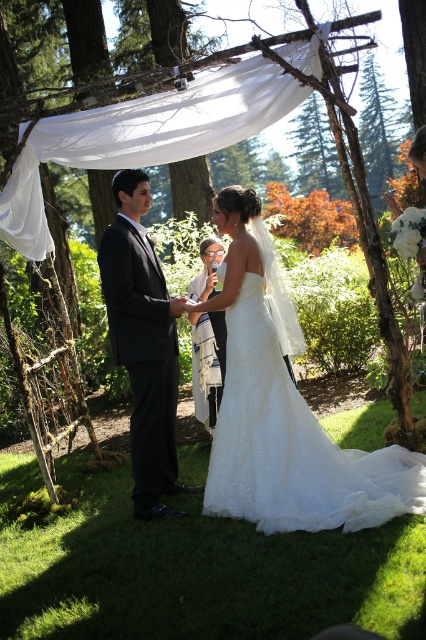
You are a photographer at the wedding and want to ensure both the white lace wedding dress at center and the black satin suit at center are fully visible in the photo. Given that the camera frame can only accommodate the width of the wider of the two, which one should you focus on to capture both properly?

The white lace wedding dress at center has a larger width than the black satin suit at center. Therefore, focusing on the white lace wedding dress at center will ensure the camera frame can accommodate both, as its width is wider.

You are a photographer at the wedding ceremony. You need to capture a photo where the white lace wedding dress at center is visible above the black satin suit at center. Based on the current arrangement, is this possible?

The white lace wedding dress at center is below the black satin suit at center, so it is not possible to capture a photo where the white lace wedding dress at center is visible above the black satin suit at center in the current arrangement.

Consider the image. You are attending an outdoor wedding ceremony and want to take a photo of the couple standing beneath the rustic arbor. You are currently positioned at point [132,285]. To get a clear shot of the couple, should you move towards point [279,524] or away from it?

You should move towards point [279,524] because it is in front of point [132,285], which will provide a clearer view of the couple beneath the rustic arbor.